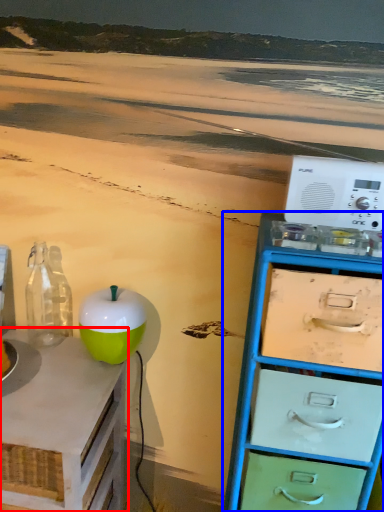
Question: Which of the following is the closest to the observer, table (highlighted by a red box) or chest of drawers (highlighted by a blue box)?

Choices:
 (A) table
 (B) chest of drawers

Answer: (B)